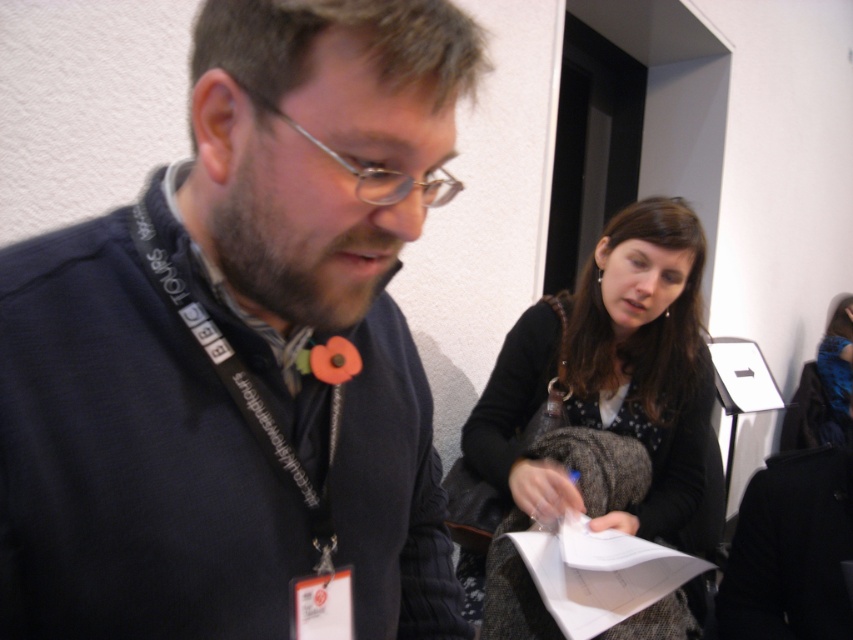
Question: Estimate the real-world distances between objects in this image. Which object is closer to the white paper at center?

Choices:
 (A) dark blue sweater at left
 (B) dark brown textured coat at center

Answer: (B)

Question: Does dark blue sweater at left appear on the right side of dark brown textured coat at center?

Choices:
 (A) no
 (B) yes

Answer: (A)

Question: Can you confirm if dark blue sweater at left is thinner than white paper at center?

Choices:
 (A) no
 (B) yes

Answer: (A)

Question: Estimate the real-world distances between objects in this image. Which object is closer to the dark blue sweater at left?

Choices:
 (A) white paper at center
 (B) dark brown textured coat at center

Answer: (A)

Question: Can you confirm if dark blue sweater at left is thinner than white paper at center?

Choices:
 (A) yes
 (B) no

Answer: (B)

Question: Among these points, which one is farthest from the camera?

Choices:
 (A) (602, 595)
 (B) (502, 525)

Answer: (B)